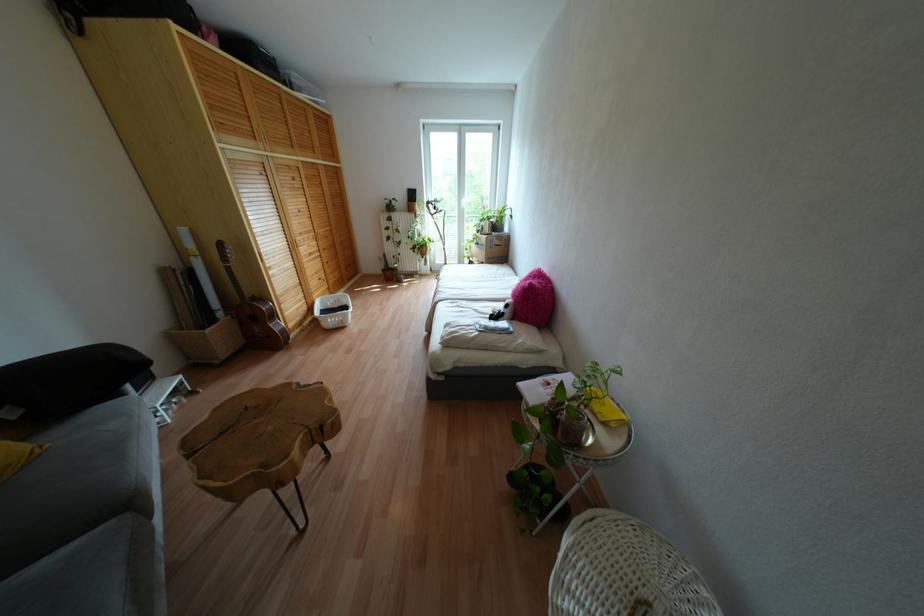
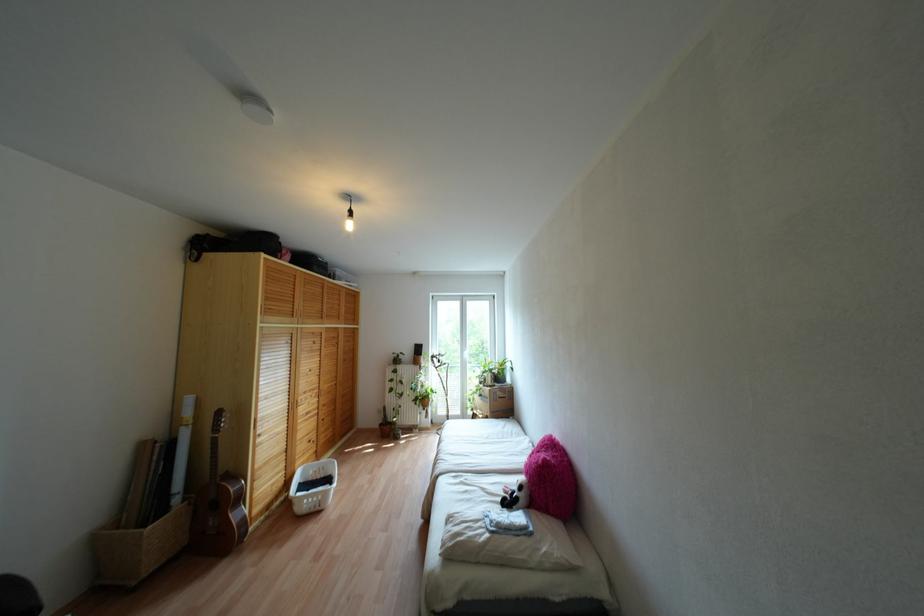
The point at (81,34) is marked in the first image. Where is the corresponding point in the second image?

(196, 260)